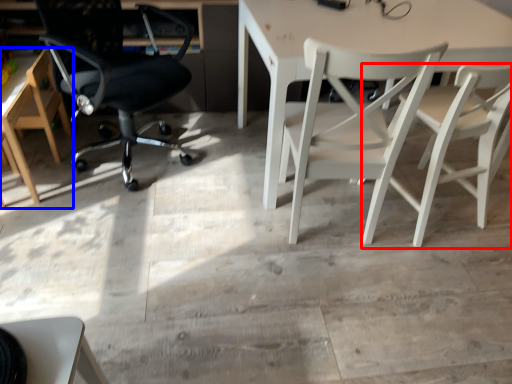
Question: Which object appears closest to the camera in this image, chair (highlighted by a red box) or chair (highlighted by a blue box)?

Choices:
 (A) chair
 (B) chair

Answer: (A)